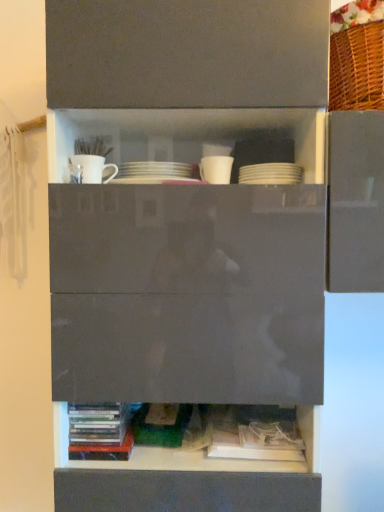
Question: Is white matte mug at upper left, which appears as the third tableware when viewed from the right, facing away from white paper book at lower center, the first book viewed from the right?

Choices:
 (A) yes
 (B) no

Answer: (B)

Question: From the image's perspective, is white matte mug at upper left, which appears as the third tableware when viewed from the right, on top of white paper book at lower center, the first book viewed from the right?

Choices:
 (A) yes
 (B) no

Answer: (A)

Question: Can you confirm if white matte mug at upper left, marked as the 1th tableware in a left-to-right arrangement, is thinner than white paper book at lower center, the first book viewed from the right?

Choices:
 (A) no
 (B) yes

Answer: (B)

Question: Does white matte mug at upper left, which appears as the third tableware when viewed from the right, have a smaller size compared to white paper book at lower center, the first book viewed from the right?

Choices:
 (A) no
 (B) yes

Answer: (B)

Question: Does white matte mug at upper left, which appears as the third tableware when viewed from the right, have a lesser height compared to white paper book at lower center, which is counted as the second book, starting from the left?

Choices:
 (A) no
 (B) yes

Answer: (A)

Question: Is white matte mug at upper left, which appears as the third tableware when viewed from the right, at the right side of white paper book at lower center, the first book viewed from the right?

Choices:
 (A) yes
 (B) no

Answer: (B)

Question: Is white paper book at lower center, which is counted as the second book, starting from the left, far from multicolored plastic books at lower left, the first book from the left?

Choices:
 (A) yes
 (B) no

Answer: (B)

Question: Is white paper book at lower center, which is counted as the second book, starting from the left, oriented towards multicolored plastic books at lower left, the first book from the left?

Choices:
 (A) no
 (B) yes

Answer: (A)

Question: Does white paper book at lower center, which is counted as the second book, starting from the left, lie behind multicolored plastic books at lower left, the first book from the left?

Choices:
 (A) yes
 (B) no

Answer: (A)

Question: Is white paper book at lower center, which is counted as the second book, starting from the left, not inside multicolored plastic books at lower left, the first book from the left?

Choices:
 (A) no
 (B) yes

Answer: (B)

Question: Does white paper book at lower center, the first book viewed from the right, have a lesser height compared to multicolored plastic books at lower left, placed as the 2th book when sorted from right to left?

Choices:
 (A) no
 (B) yes

Answer: (B)

Question: Is multicolored plastic books at lower left, the first book from the left, a part of white paper book at lower center, the first book viewed from the right?

Choices:
 (A) no
 (B) yes

Answer: (A)

Question: Can you confirm if white paper book at lower center, which is counted as the second book, starting from the left, is bigger than white matte mug at upper left, marked as the 1th tableware in a left-to-right arrangement?

Choices:
 (A) yes
 (B) no

Answer: (A)